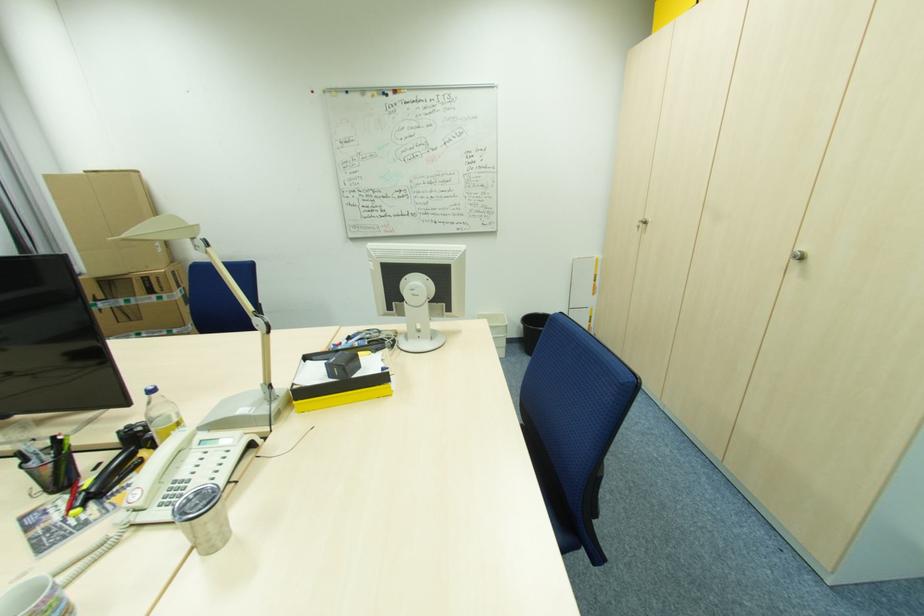
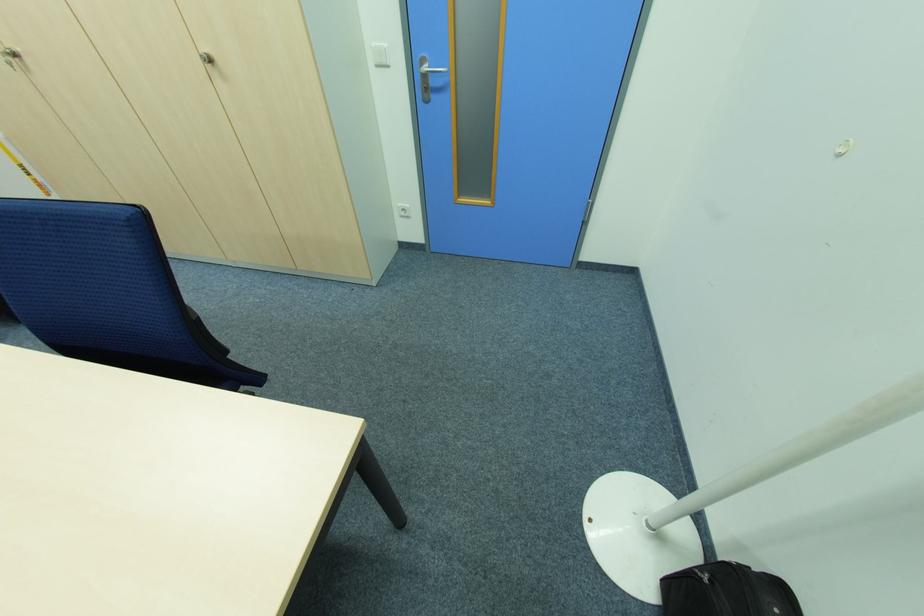
In the second image, find the point that corresponds to (804,257) in the first image.

(213, 62)